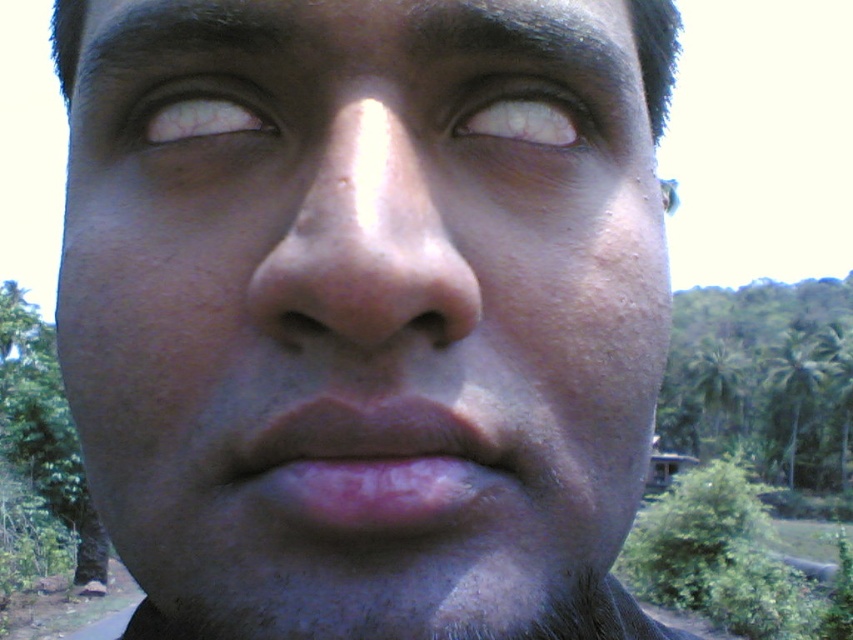
You are a makeup artist preparing to apply lipstick. You need to ensure the lipstick fits within the visible area of the face. Given that the smooth skin face at center is larger than the pink matte lips at center, will the lipstick application area be entirely within the face?

Yes, the smooth skin face at center is larger in size than the pink matte lips at center, so the lipstick application area will be entirely within the face.